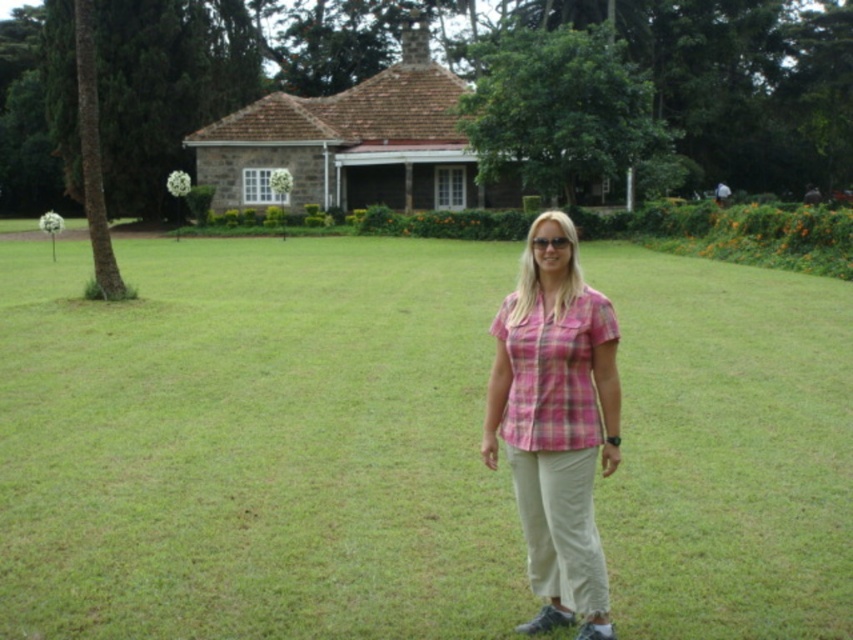
You are a gardener who needs to mow the lawn. You see the green grass at center and the pink plaid shirt at center in the scene. Which object is taller and requires more attention for mowing?

The green grass at center is much taller than the pink plaid shirt at center, so it requires more attention for mowing.